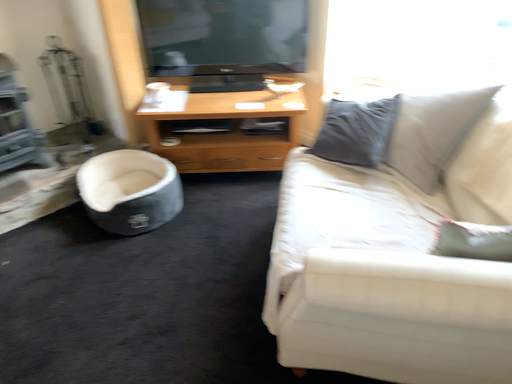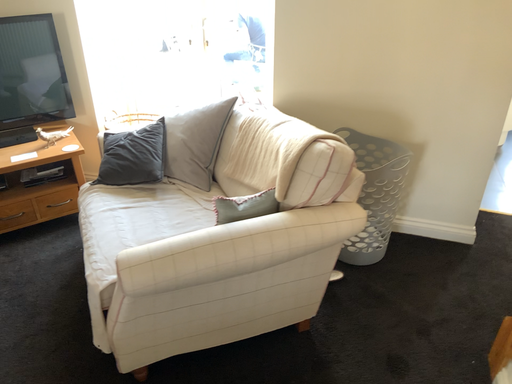
Question: Which way did the camera rotate in the video?

Choices:
 (A) rotated upward
 (B) rotated downward

Answer: (A)